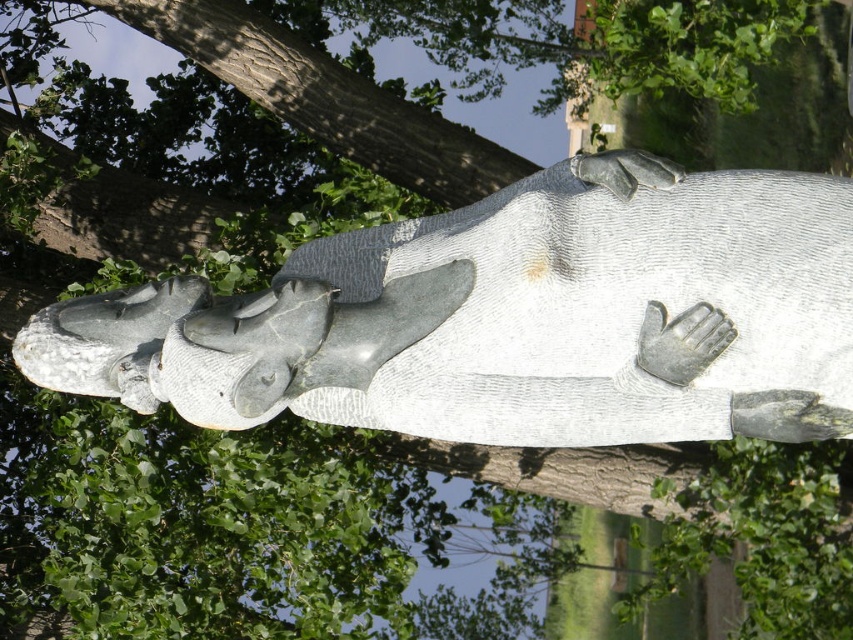
You are an artist trying to sketch the scene. You notice the gray stone statue at center and the silver metallic hand at center. Based on their positions, which object is closer to the left side of the image?

The gray stone statue at center is closer to the left side of the image because it is positioned to the left of the silver metallic hand at center.

You are a painter standing at the base of the gray stone statue at center and the silver metallic hand at center. You want to paint both objects but have a limited amount of paint. Which object requires more paint due to its larger surface area?

The gray stone statue at center is much taller than the silver metallic hand at center, so it has a larger surface area and requires more paint.